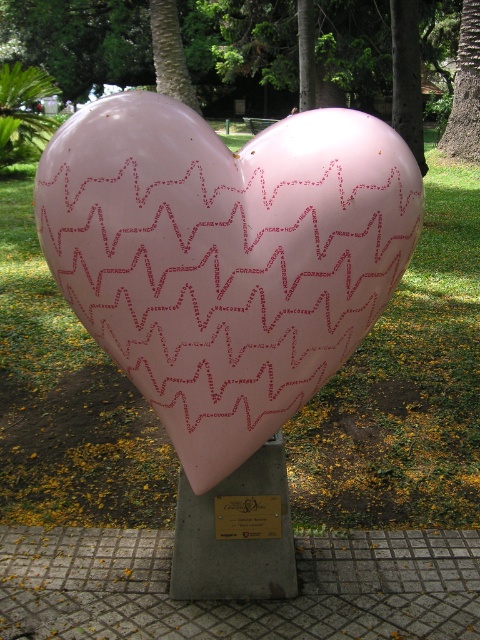
You are a park visitor who wants to take a photo of both the smooth brown tree trunk at right and the metallic gold plaque at center in the same frame. Given that your camera has a maximum zoom range of 10 meters, can you capture both objects in a single photo without moving your position?

The smooth brown tree trunk at right and metallic gold plaque at center are 11.51 meters apart from each other. Since your camera can only zoom up to 10 meters, you cannot capture both objects in a single photo without moving your position because the distance between them exceeds the camera range.

You are standing in the park and see the matte pink heart at center. If you walk directly towards the sculpture, which direction should you face to ensure you are moving straight toward it?

You should face the direction where the coordinates point to the matte pink heart at center located at point (x=226, y=289) to move straight toward it.

You are an artist planning to paint the scene of the heart sculpture. You need to decide which object to focus on first based on their sizes. Which object should you paint first, the green textured palm tree at upper center or the metallic gold plaque at center?

The green textured palm tree at upper center is much taller than the metallic gold plaque at center, so you should paint the green textured palm tree at upper center first as it is larger and will require more attention to detail.